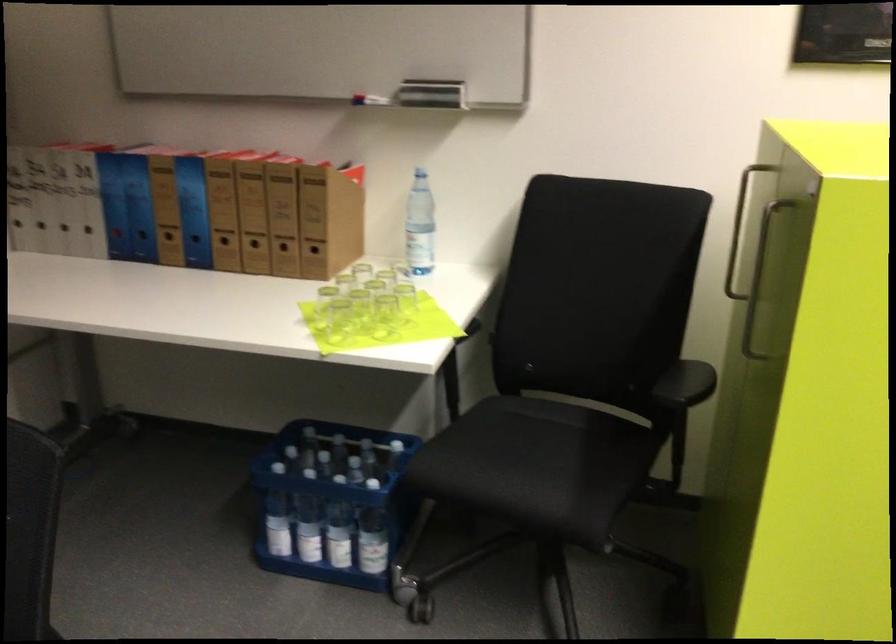
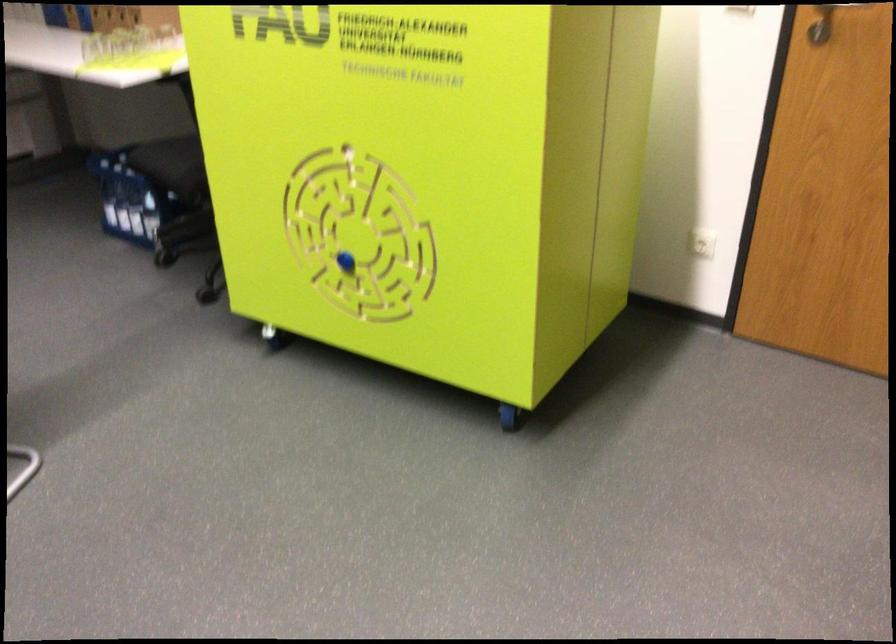
Find the pixel in the second image that matches point (363, 496) in the first image.

(149, 185)